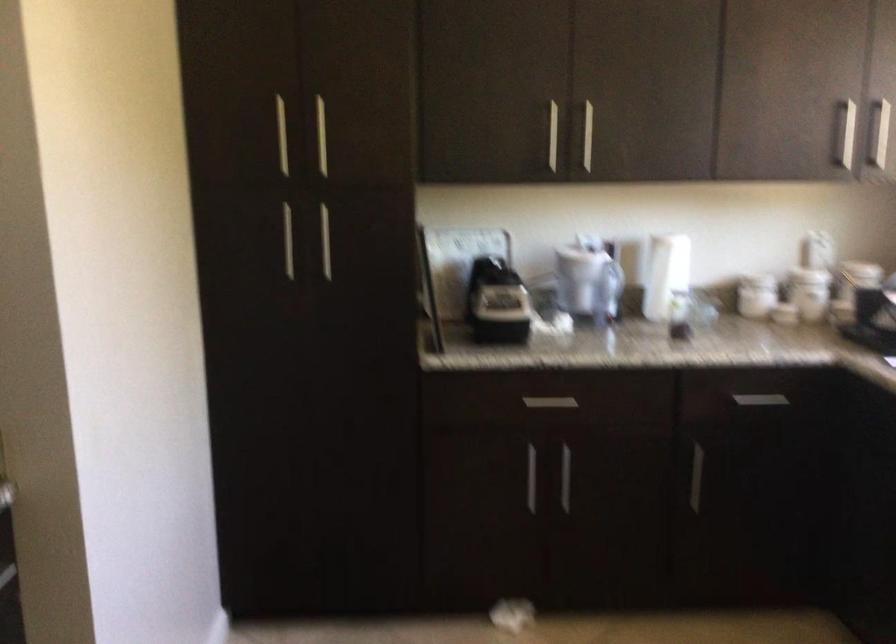
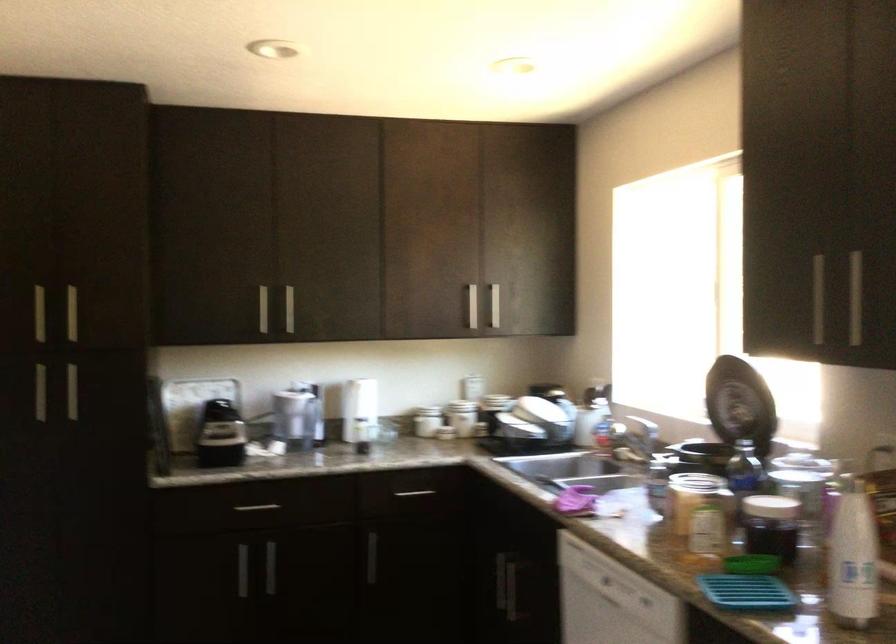
In the second image, find the point that corresponds to point 496,303 in the first image.

(220, 435)